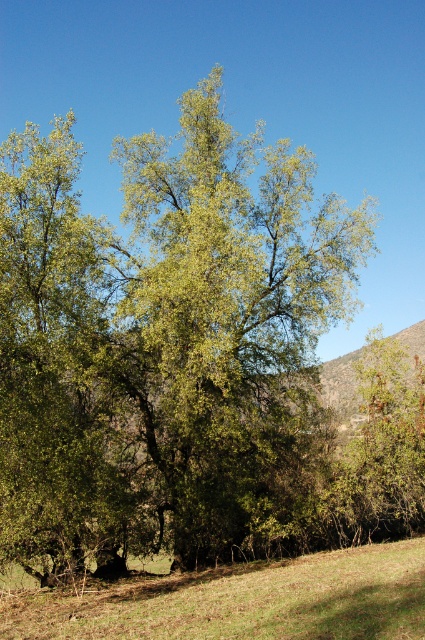
Which of these two, green leafy tree at center or green grassy field at lower center, stands shorter?

green grassy field at lower center

This screenshot has width=425, height=640. What do you see at coordinates (167, 348) in the screenshot? I see `green leafy tree at center` at bounding box center [167, 348].

Does point (141, 200) come behind point (319, 598)?

Yes, it is.

The image size is (425, 640). In order to click on green leafy tree at center in this screenshot , I will do `click(167, 348)`.